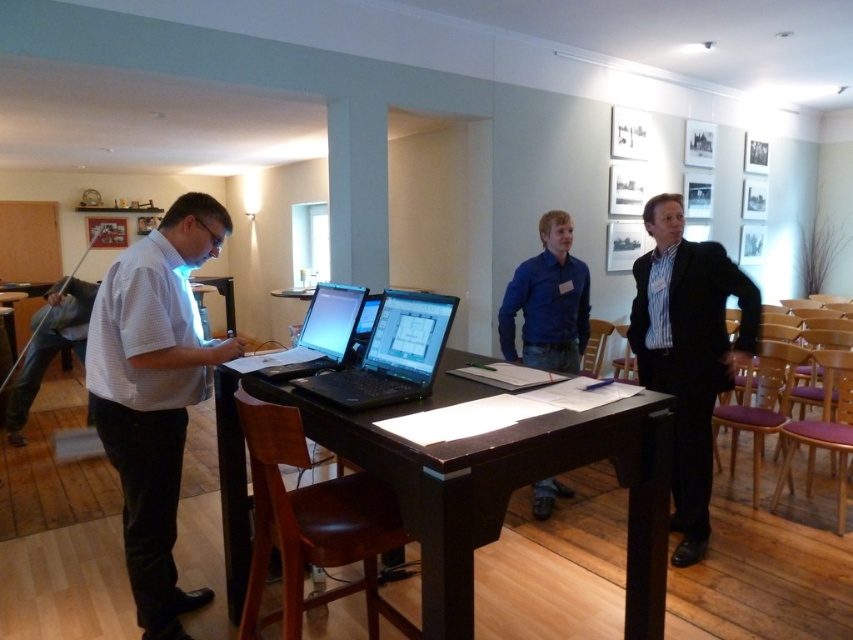
Does blue cotton shirt at center have a lesser width compared to shiny black laptop at center?

No, blue cotton shirt at center is not thinner than shiny black laptop at center.

Measure the distance from blue cotton shirt at center to shiny black laptop at center.

blue cotton shirt at center and shiny black laptop at center are 1.28 meters apart from each other.

Identify the location of blue cotton shirt at center. (548, 301).

Where is `blue cotton shirt at center`? blue cotton shirt at center is located at coordinates (548, 301).

Can you confirm if white checkered shirt at center is thinner than striped cotton shirt at center?

No.

Which is more to the right, white checkered shirt at center or striped cotton shirt at center?

striped cotton shirt at center

Does point (149, 602) lie in front of point (670, 260)?

Yes, it is.

Identify the location of white checkered shirt at center. (154, 394).

Which is more to the right, dark wood table at center or blue cotton shirt at center?

blue cotton shirt at center

Between dark wood table at center and blue cotton shirt at center, which one has more height?

Standing taller between the two is dark wood table at center.

Is point (424, 451) farther from viewer compared to point (523, 314)?

No.

Locate an element on the screen. This screenshot has height=640, width=853. dark wood table at center is located at coordinates (502, 484).